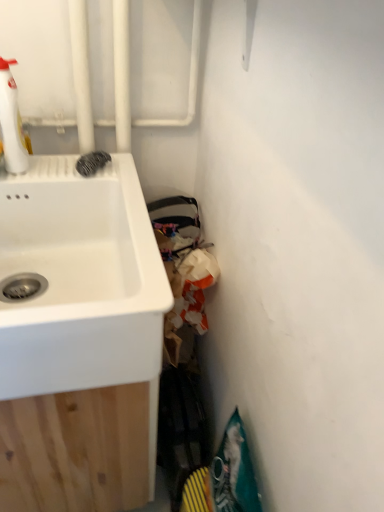
The width and height of the screenshot is (384, 512). What do you see at coordinates (11, 121) in the screenshot? I see `white glossy spray bottle at upper left` at bounding box center [11, 121].

Identify the location of white glossy spray bottle at upper left. This screenshot has height=512, width=384. (11, 121).

What is the approximate width of white matte sink at left?

white matte sink at left is 26.17 inches wide.

What do you see at coordinates (79, 279) in the screenshot?
I see `white matte sink at left` at bounding box center [79, 279].

I want to click on white matte sink at left, so click(79, 279).

What is the approximate height of white matte sink at left?

white matte sink at left is 10.03 inches in height.

Locate an element on the screen. This screenshot has width=384, height=512. white glossy spray bottle at upper left is located at coordinates (11, 121).

Which object is positioned more to the left, white matte sink at left or white glossy spray bottle at upper left?

Positioned to the left is white glossy spray bottle at upper left.

Does white matte sink at left lie behind white glossy spray bottle at upper left?

That is False.

Is point (132, 236) behind point (7, 127)?

No, (132, 236) is closer to viewer.

From the image's perspective, which is below, white matte sink at left or white glossy spray bottle at upper left?

From the image's view, white matte sink at left is below.

From a real-world perspective, is white matte sink at left physically below white glossy spray bottle at upper left?

Yes, from a real-world perspective, white matte sink at left is below white glossy spray bottle at upper left.

In terms of width, does white matte sink at left look wider or thinner when compared to white glossy spray bottle at upper left?

Considering their sizes, white matte sink at left looks broader than white glossy spray bottle at upper left.

From their relative heights in the image, would you say white matte sink at left is taller or shorter than white glossy spray bottle at upper left?

In the image, white matte sink at left appears to be taller than white glossy spray bottle at upper left.

Can you confirm if white matte sink at left is smaller than white glossy spray bottle at upper left?

Incorrect, white matte sink at left is not smaller in size than white glossy spray bottle at upper left.

Would you say white matte sink at left is outside white glossy spray bottle at upper left?

white matte sink at left is positioned outside white glossy spray bottle at upper left.

Would you consider white matte sink at left to be distant from white glossy spray bottle at upper left?

white matte sink at left is actually quite close to white glossy spray bottle at upper left.

Is white matte sink at left oriented away from white glossy spray bottle at upper left?

No, white matte sink at left is not facing the opposite direction of white glossy spray bottle at upper left.

What's the angular difference between white matte sink at left and white glossy spray bottle at upper left's facing directions?

The angular difference between white matte sink at left and white glossy spray bottle at upper left is 0.204 degrees.

Where is `cleaning product that appears above the white matte sink at left (from a real-world perspective)`? The image size is (384, 512). cleaning product that appears above the white matte sink at left (from a real-world perspective) is located at coordinates (11, 121).

Considering the relative positions of white glossy spray bottle at upper left and white matte sink at left in the image provided, is white glossy spray bottle at upper left to the left of white matte sink at left from the viewer's perspective?

Yes, white glossy spray bottle at upper left is to the left of white matte sink at left.

Relative to white matte sink at left, is white glossy spray bottle at upper left in front or behind?

white glossy spray bottle at upper left is positioned farther from the viewer than white matte sink at left.

Is point (8, 71) in front of point (8, 271)?

Yes, it is.

From the image's perspective, does white glossy spray bottle at upper left appear higher than white matte sink at left?

Correct, white glossy spray bottle at upper left appears higher than white matte sink at left in the image.

Based on the photo, from a real-world perspective, is white glossy spray bottle at upper left physically below white matte sink at left?

Incorrect, from a real-world perspective, white glossy spray bottle at upper left is higher than white matte sink at left.

Which of these two, white glossy spray bottle at upper left or white matte sink at left, is wider?

With larger width is white matte sink at left.

Who is shorter, white glossy spray bottle at upper left or white matte sink at left?

With less height is white glossy spray bottle at upper left.

Is white glossy spray bottle at upper left bigger than white matte sink at left?

No.

Is white matte sink at left inside white glossy spray bottle at upper left?

No, white glossy spray bottle at upper left does not contain white matte sink at left.

Is white glossy spray bottle at upper left not near white matte sink at left?

That's not correct — white glossy spray bottle at upper left is a little close to white matte sink at left.

Is white glossy spray bottle at upper left positioned with its back to white matte sink at left?

No, white glossy spray bottle at upper left is not facing the opposite direction of white matte sink at left.

Identify the location of cleaning product above the white matte sink at left (from a real-world perspective). This screenshot has height=512, width=384. (11, 121).

At what (x,y) coordinates should I click in order to perform the action: click on sink located underneath the white glossy spray bottle at upper left (from a real-world perspective). Please return your answer as a coordinate pair (x, y). This screenshot has height=512, width=384. Looking at the image, I should click on (79, 279).

Where is `cleaning product above the white matte sink at left (from a real-world perspective)`? The image size is (384, 512). cleaning product above the white matte sink at left (from a real-world perspective) is located at coordinates (11, 121).